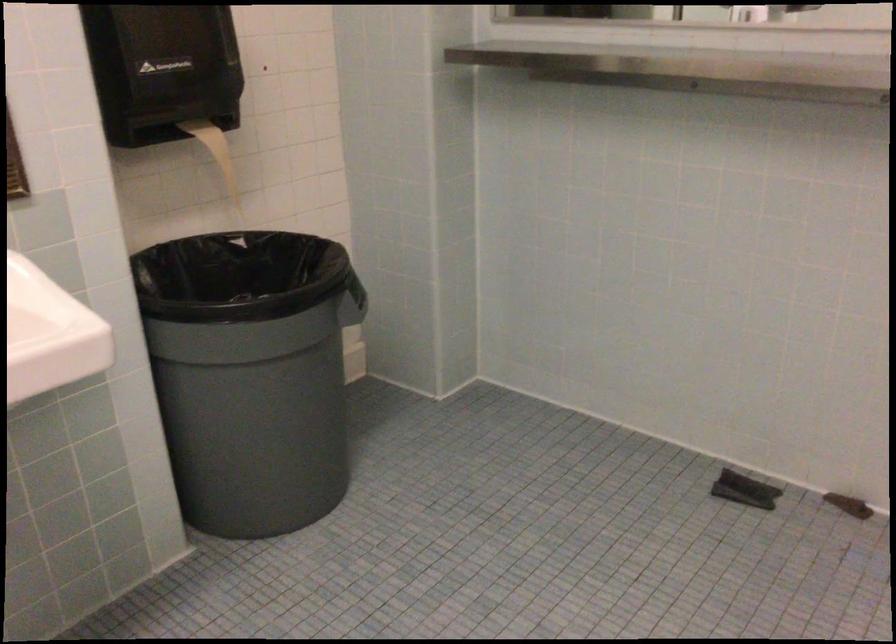
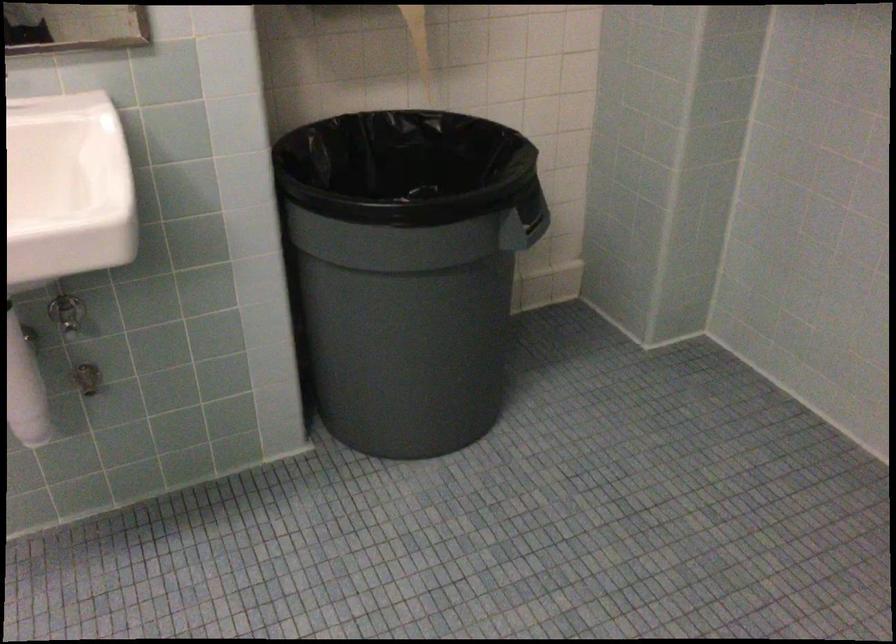
In a continuous first-person perspective shot, in which direction is the camera moving?

The cameraman walked toward right, forward.